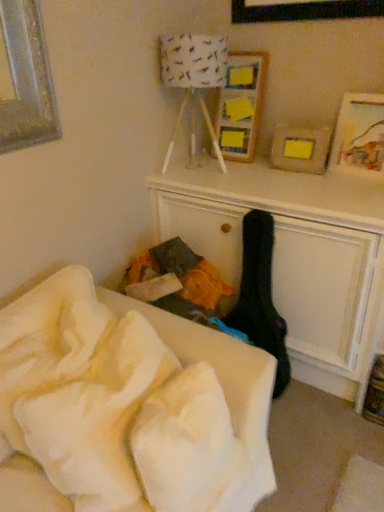
Question: Is wooden picture frame at upper center, placed as the second picture frame when sorted from right to left, outside of white paper lampshade at upper center?

Choices:
 (A) no
 (B) yes

Answer: (B)

Question: Is the depth of wooden picture frame at upper center, which is counted as the first picture frame, starting from the left, less than that of white paper lampshade at upper center?

Choices:
 (A) yes
 (B) no

Answer: (B)

Question: Considering the relative positions of wooden picture frame at upper center, which is counted as the first picture frame, starting from the left, and white paper lampshade at upper center in the image provided, is wooden picture frame at upper center, which is counted as the first picture frame, starting from the left, to the left of white paper lampshade at upper center from the viewer's perspective?

Choices:
 (A) no
 (B) yes

Answer: (A)

Question: Is wooden picture frame at upper center, placed as the second picture frame when sorted from right to left, oriented away from white paper lampshade at upper center?

Choices:
 (A) yes
 (B) no

Answer: (B)

Question: Does wooden picture frame at upper center, placed as the second picture frame when sorted from right to left, have a greater height compared to white paper lampshade at upper center?

Choices:
 (A) yes
 (B) no

Answer: (B)

Question: Does point (261, 324) appear closer or farther from the camera than point (39, 490)?

Choices:
 (A) closer
 (B) farther

Answer: (B)

Question: From the image's perspective, is black fabric guitar case at center located above or below white soft blanket at lower left?

Choices:
 (A) below
 (B) above

Answer: (B)

Question: Looking at their shapes, would you say black fabric guitar case at center is wider or thinner than white soft blanket at lower left?

Choices:
 (A) wide
 (B) thin

Answer: (B)

Question: Is black fabric guitar case at center inside the boundaries of white soft blanket at lower left, or outside?

Choices:
 (A) outside
 (B) inside

Answer: (A)

Question: From a real-world perspective, is wooden picture frame at upper center, placed as the second picture frame when sorted from right to left, positioned above or below wooden painted picture frame at upper right, the second picture frame viewed from the left?

Choices:
 (A) above
 (B) below

Answer: (A)

Question: Would you say wooden picture frame at upper center, which is counted as the first picture frame, starting from the left, is inside or outside wooden painted picture frame at upper right, which is the first picture frame from right to left?

Choices:
 (A) outside
 (B) inside

Answer: (A)

Question: From the image's perspective, is wooden picture frame at upper center, placed as the second picture frame when sorted from right to left, located above or below wooden painted picture frame at upper right, the second picture frame viewed from the left?

Choices:
 (A) above
 (B) below

Answer: (A)

Question: Considering the positions of wooden picture frame at upper center, placed as the second picture frame when sorted from right to left, and wooden painted picture frame at upper right, the second picture frame viewed from the left, in the image, is wooden picture frame at upper center, placed as the second picture frame when sorted from right to left, bigger or smaller than wooden painted picture frame at upper right, the second picture frame viewed from the left,?

Choices:
 (A) big
 (B) small

Answer: (A)

Question: Looking at the image, does white soft blanket at lower left seem bigger or smaller compared to wooden painted picture frame at upper right, which is the first picture frame from right to left?

Choices:
 (A) small
 (B) big

Answer: (B)

Question: In terms of width, does white soft blanket at lower left look wider or thinner when compared to wooden painted picture frame at upper right, the second picture frame viewed from the left?

Choices:
 (A) wide
 (B) thin

Answer: (A)